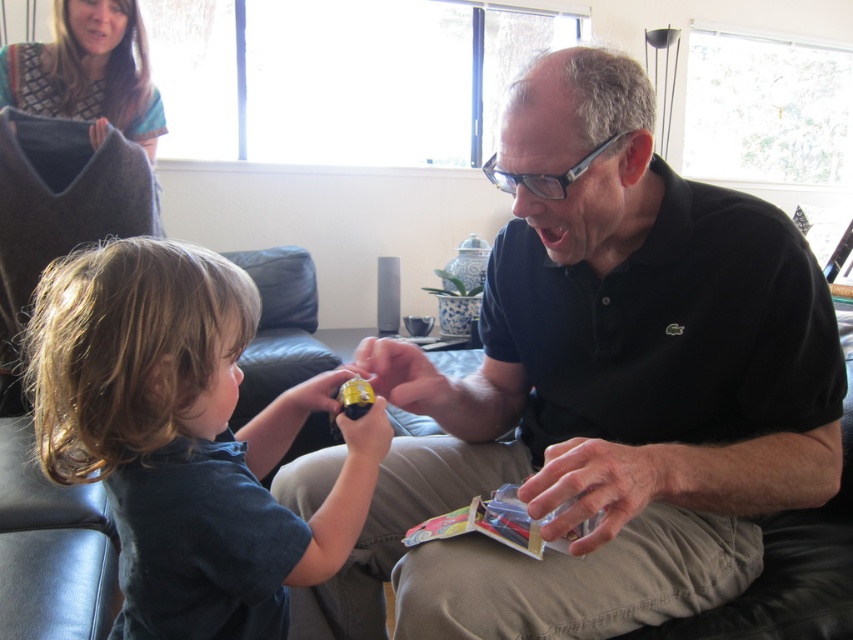
You are a fashion designer observing two shirts in a photo. The black matte shirt at center and the smooth dark blue shirt at lower left. Which one has a wider silhouette?

The black matte shirt at center might be wider than smooth dark blue shirt at lower left.